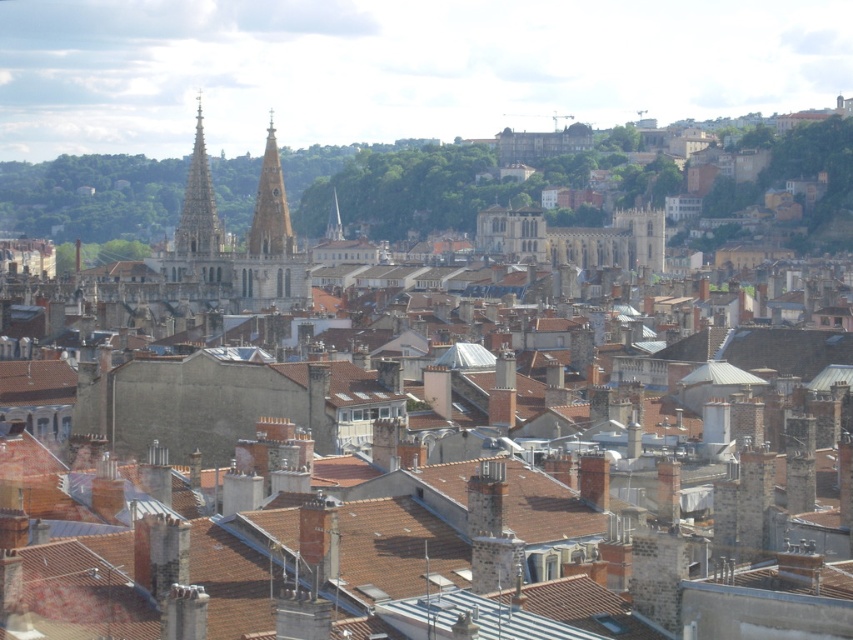
You are an architect analyzing the cityscape. You need to determine the exact position of the polished stone spire at upper left in the image. What are its coordinates?

The polished stone spire at upper left is located at coordinates point (198, 204).

What are the coordinates of the polished stone spire at upper left in the cityscape image?

The polished stone spire at upper left is located at coordinates (x=198, y=204).